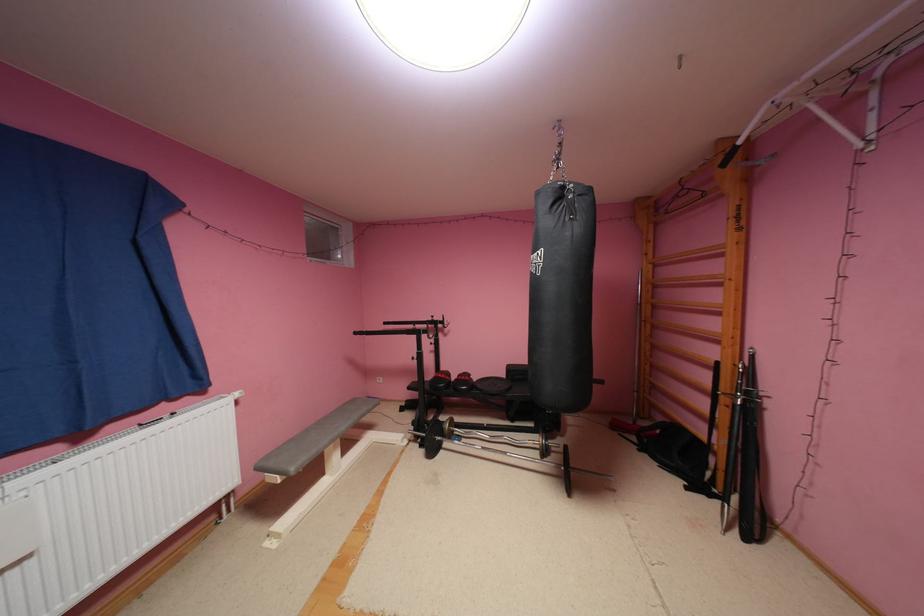
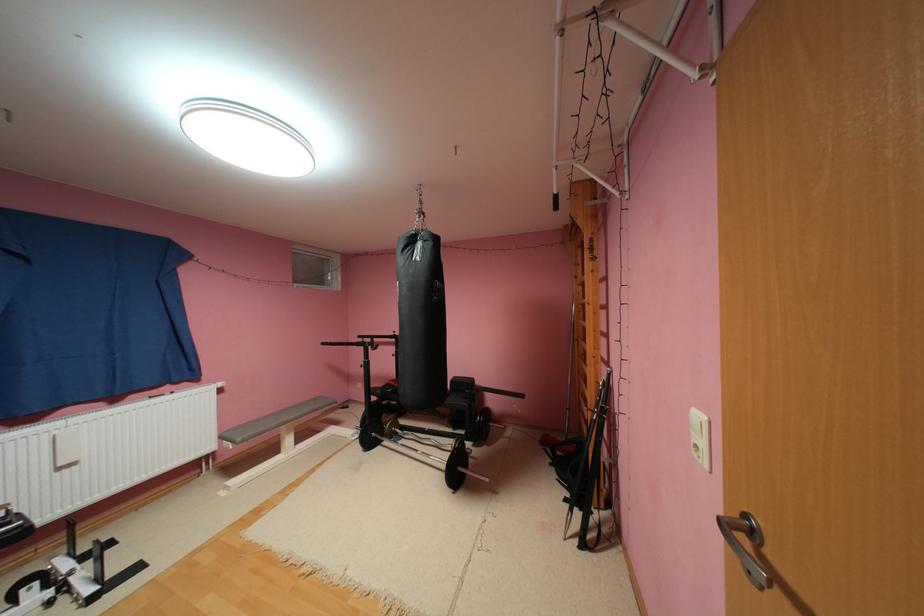
Where in the second image is the point corresponding to pixel 546 447 from the first image?

(458, 450)